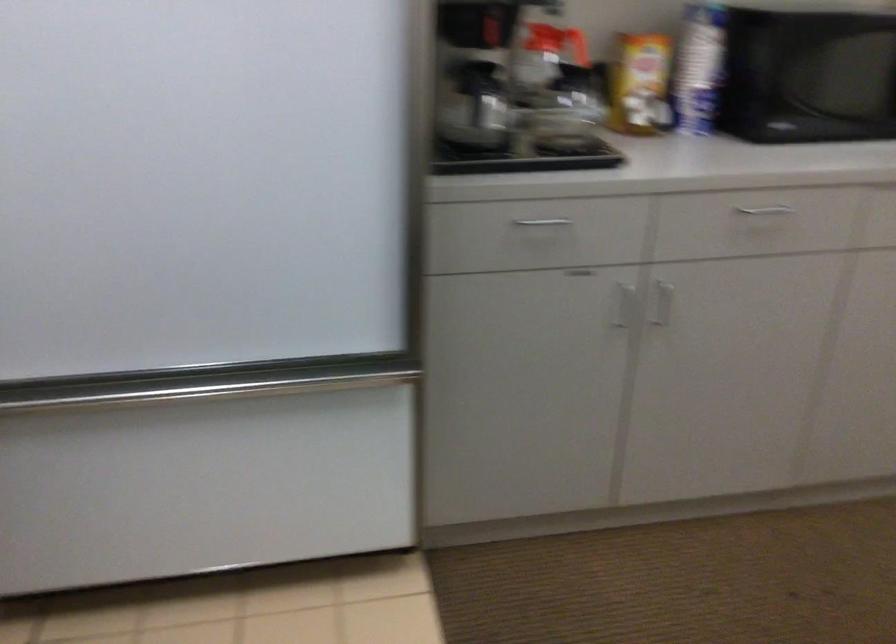
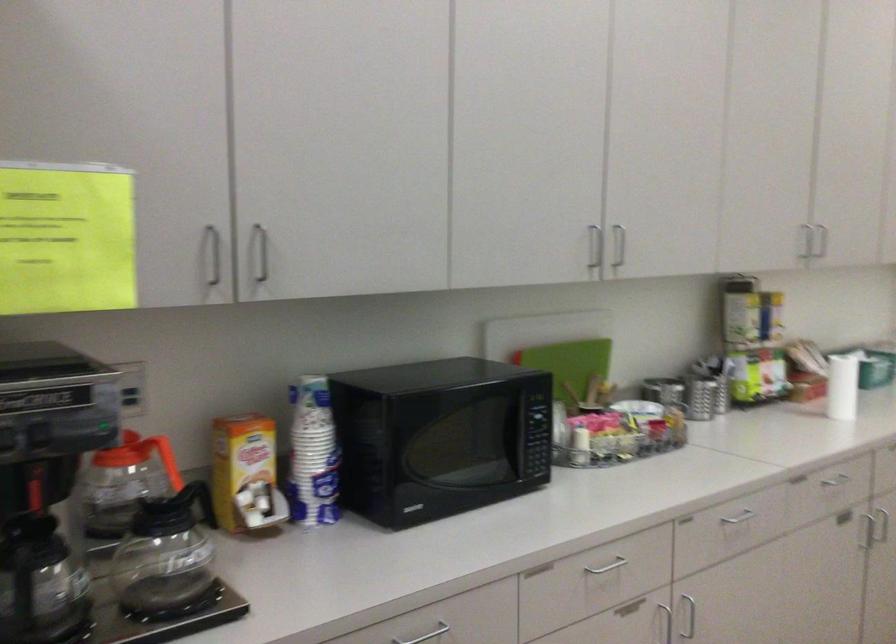
The point at (776, 210) is marked in the first image. Where is the corresponding point in the second image?

(425, 635)